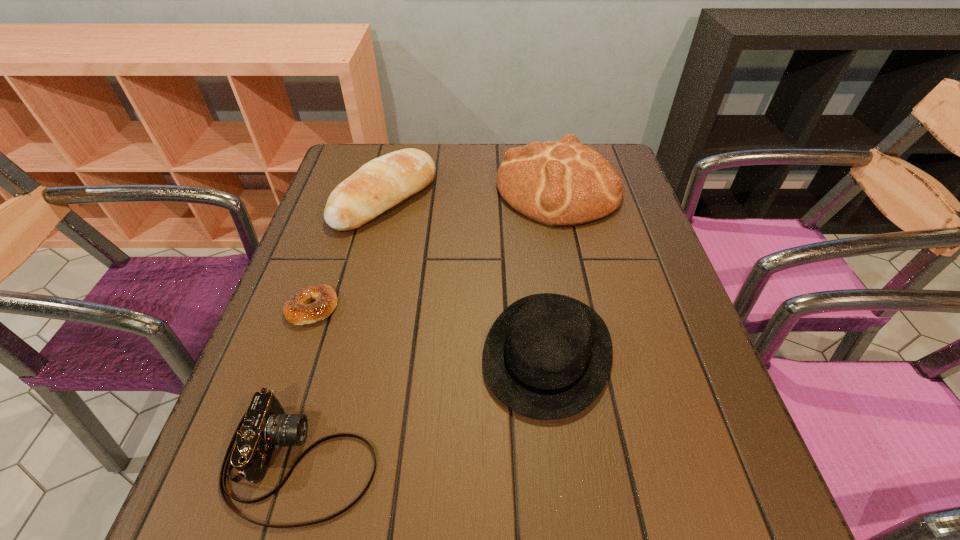
Identify the location of vacant region located 0.280m on the right of the bagel. This screenshot has width=960, height=540. (477, 307).

Where is `object at the near edge`? This screenshot has height=540, width=960. object at the near edge is located at coordinates (264, 426).

Image resolution: width=960 pixels, height=540 pixels. Identify the location of bread located in the left edge section of the desktop. (382, 183).

This screenshot has height=540, width=960. I want to click on camera that is at the left edge, so click(264, 426).

The width and height of the screenshot is (960, 540). Find the location of `bagel that is at the left edge`. bagel that is at the left edge is located at coordinates (296, 309).

Image resolution: width=960 pixels, height=540 pixels. What are the coordinates of `bread located at the right edge` in the screenshot? It's located at (563, 183).

You are a GUI agent. You are given a task and a screenshot of the screen. Output one action in this format:
    pyautogui.click(x=<x>, y=<y>)
    Task: Click on the fedora at the right edge
    The image size is (960, 540).
    Given the screenshot: What is the action you would take?
    pyautogui.click(x=548, y=356)

Find the location of a particular element. Image resolution: width=960 pixels, height=540 pixels. object present at the far left corner is located at coordinates (382, 183).

Where is `object that is at the near left corner`? This screenshot has width=960, height=540. object that is at the near left corner is located at coordinates (264, 426).

You are a GUI agent. You are given a task and a screenshot of the screen. Output one action in this format:
    pyautogui.click(x=<x>, y=<y>)
    Task: Click on the object that is at the far right corner
    This screenshot has width=960, height=540.
    Given the screenshot: What is the action you would take?
    pyautogui.click(x=563, y=183)